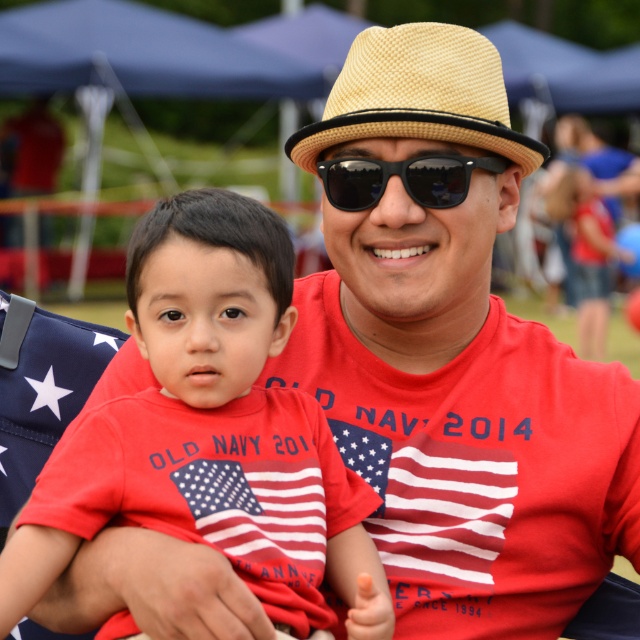
Does matte red t-shirt at center have a lesser width compared to black reflective sunglasses at center?

In fact, matte red t-shirt at center might be wider than black reflective sunglasses at center.

Who is more distant from viewer, (243, 544) or (426, 196)?

Positioned behind is point (426, 196).

Image resolution: width=640 pixels, height=640 pixels. I want to click on matte red t-shirt at center, so click(x=211, y=428).

In the scene shown: Is matte red t-shirt at center bigger than american flag fabric at left?

Yes.

Which is below, matte red t-shirt at center or american flag fabric at left?

american flag fabric at left is below.

Is point (134, 406) closer to camera compared to point (3, 353)?

That is True.

You are a GUI agent. You are given a task and a screenshot of the screen. Output one action in this format:
    pyautogui.click(x=<x>, y=<y>)
    Task: Click on the matte red t-shirt at center
    
    Given the screenshot: What is the action you would take?
    pyautogui.click(x=211, y=428)

Locate an element on the screen. american flag fabric at left is located at coordinates (42, 388).

Consider the image. How distant is american flag fabric at left from black reflective sunglasses at center?

4.29 feet

Where is `american flag fabric at left`? american flag fabric at left is located at coordinates (42, 388).

Locate an element on the screen. This screenshot has width=640, height=640. american flag fabric at left is located at coordinates (42, 388).